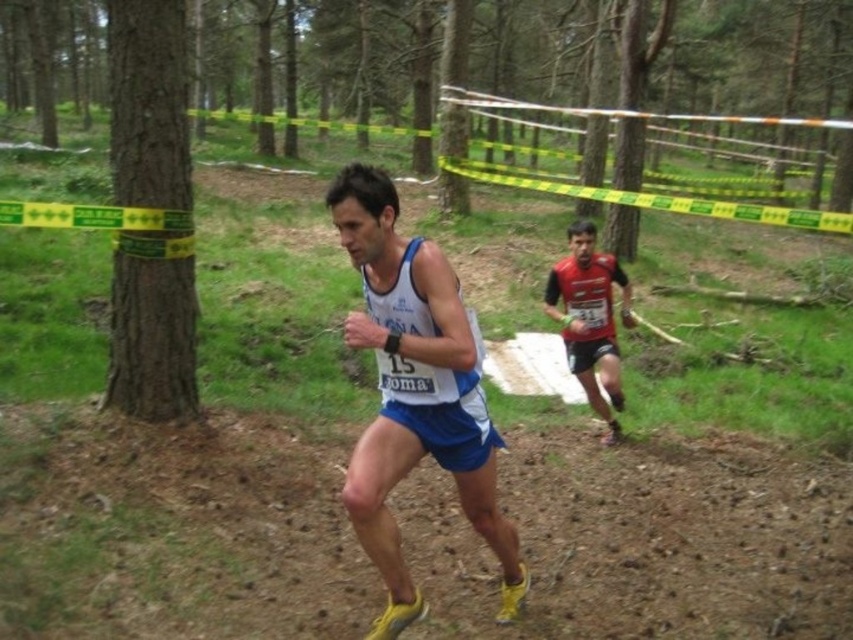
Is brown dirt track at center shorter than matte red running suit at center?

Yes.

Does brown dirt track at center appear on the right side of matte red running suit at center?

No, brown dirt track at center is not to the right of matte red running suit at center.

Find the location of a particular element. This screenshot has height=640, width=853. brown dirt track at center is located at coordinates (642, 541).

Image resolution: width=853 pixels, height=640 pixels. Describe the element at coordinates (415, 392) in the screenshot. I see `white fabric tank top at center` at that location.

Who is more forward, (397,380) or (585,349)?

Point (397,380)

Find the location of a particular element. This screenshot has width=853, height=640. white fabric tank top at center is located at coordinates (415, 392).

Is brown dirt track at center positioned in front of white fabric tank top at center?

That is False.

Is brown dirt track at center to the right of white fabric tank top at center from the viewer's perspective?

Indeed, brown dirt track at center is positioned on the right side of white fabric tank top at center.

This screenshot has height=640, width=853. Find the location of `brown dirt track at center`. brown dirt track at center is located at coordinates (642, 541).